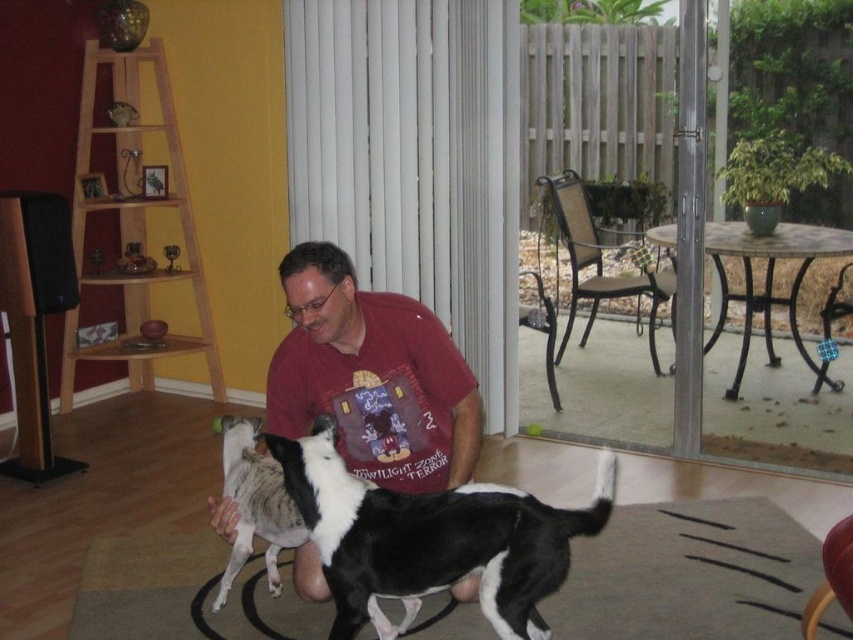
Which of these two, clear glass screen door at right or matte red shirt at center, stands taller?

Standing taller between the two is clear glass screen door at right.

Can you confirm if clear glass screen door at right is positioned below matte red shirt at center?

No, clear glass screen door at right is not below matte red shirt at center.

Between point (584, 124) and point (399, 420), which one is positioned behind?

Point (584, 124)

This screenshot has height=640, width=853. What are the coordinates of `clear glass screen door at right` in the screenshot? It's located at (619, 221).

Is clear glass screen door at right closer to camera compared to black and white fur dog at center?

No, clear glass screen door at right is further to the viewer.

Is point (653, 54) less distant than point (328, 476)?

No.

Who is more distant from viewer, (x=619, y=147) or (x=378, y=586)?

Point (x=619, y=147)

I want to click on clear glass screen door at right, so click(x=619, y=221).

Who is more forward, (659, 513) or (514, 570)?

Positioned in front is point (514, 570).

Where is `soft beige rug at lower center`? The width and height of the screenshot is (853, 640). soft beige rug at lower center is located at coordinates (689, 573).